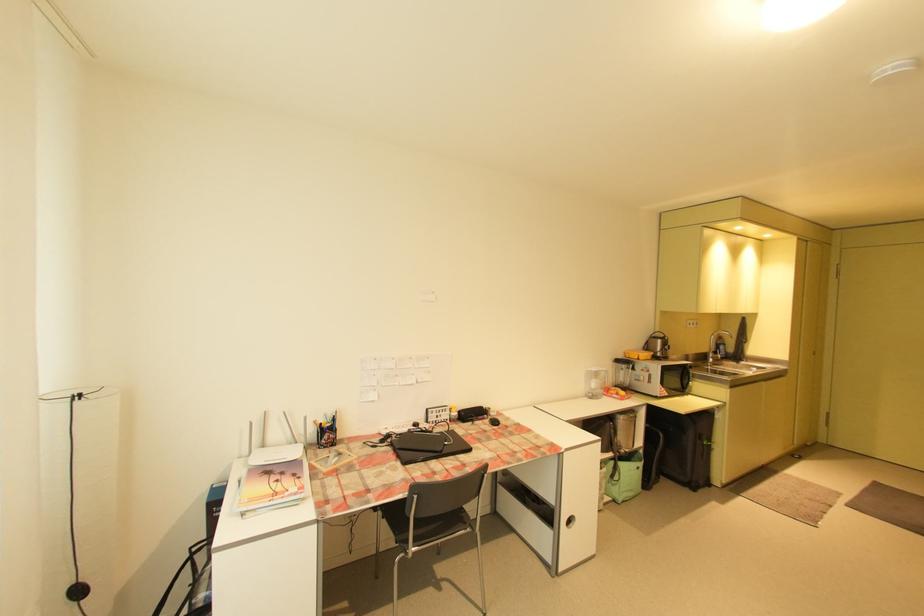
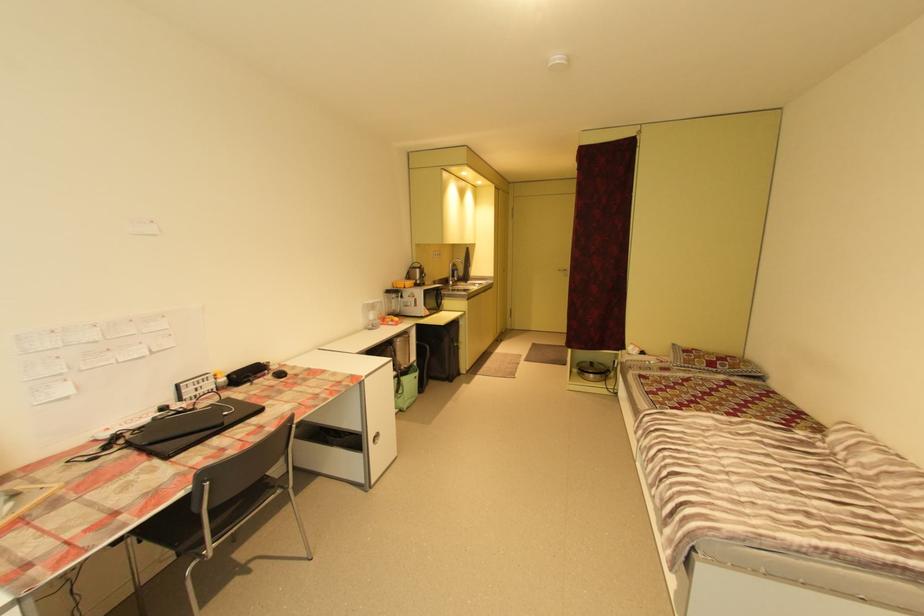
Question: The camera is either moving clockwise (left) or counter-clockwise (right) around the object. The first image is from the beginning of the video and the second image is from the end. Is the camera moving left or right when shooting the video?

Choices:
 (A) Left
 (B) Right

Answer: (A)